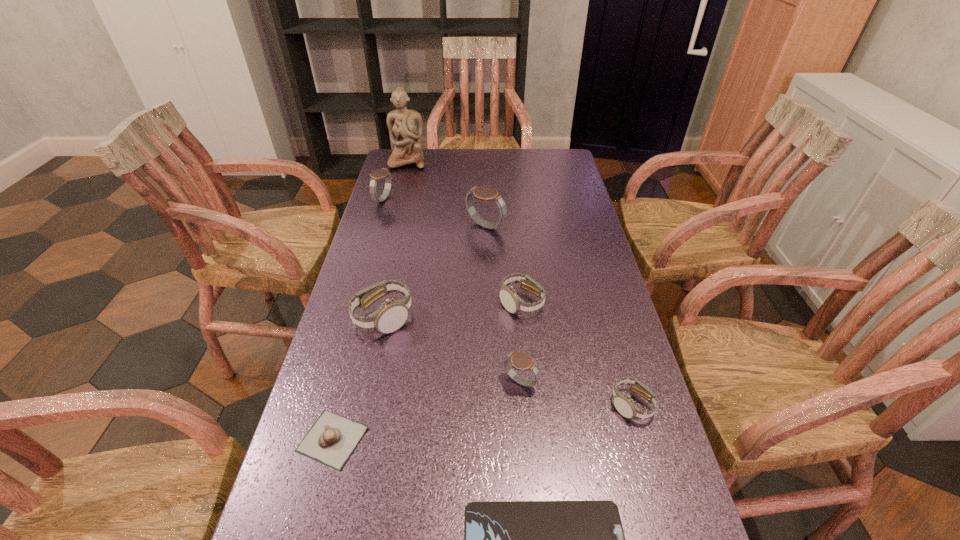
At what (x,y) coordinates should I click in order to perform the action: click on object at the far edge. Please return your answer as a coordinate pair (x, y). Looking at the image, I should click on (413, 539).

What are the coordinates of `figurine present at the left edge` in the screenshot? It's located at (413, 539).

What are the coordinates of `garlic present at the left edge` in the screenshot? It's located at [413, 539].

This screenshot has height=540, width=960. I want to click on object that is at the right edge, so click(x=413, y=539).

At what (x,y) coordinates should I click in order to perform the action: click on object present at the far left corner. Please return your answer as a coordinate pair (x, y). Looking at the image, I should click on (413, 539).

Locate which object is the sixth closest to the second tallest object. Please provide its 2D coordinates. Your answer should be formatted as a tuple, i.e. [(x, y)], where the tuple contains the x and y coordinates of a point satisfying the conditions above.

[(413, 539)]

Find the location of a particular element. The height and width of the screenshot is (540, 960). object that is the fourth closest to the second nearest gray watch is located at coordinates (413, 539).

The image size is (960, 540). What are the coordinates of `watch identified as the fourth closest to the farthest watch` in the screenshot? It's located at (479, 539).

Identify which watch is located as the third nearest to the smallest gray watch. Please provide its 2D coordinates. Your answer should be formatted as a tuple, i.e. [(x, y)], where the tuple contains the x and y coordinates of a point satisfying the conditions above.

[(413, 539)]

Locate an element on the screen. The height and width of the screenshot is (540, 960). gray watch that is the second closest to the nearest gray watch is located at coordinates (413, 539).